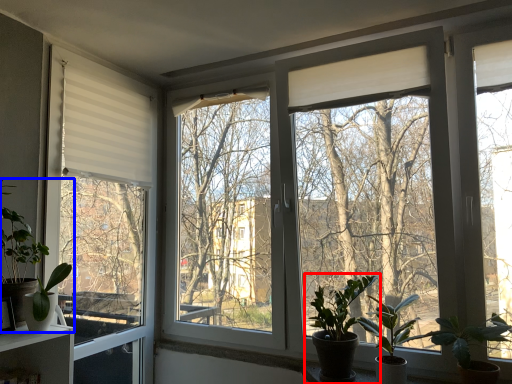
Question: Which object is further to the camera taking this photo, houseplant (highlighted by a red box) or houseplant (highlighted by a blue box)?

Choices:
 (A) houseplant
 (B) houseplant

Answer: (A)